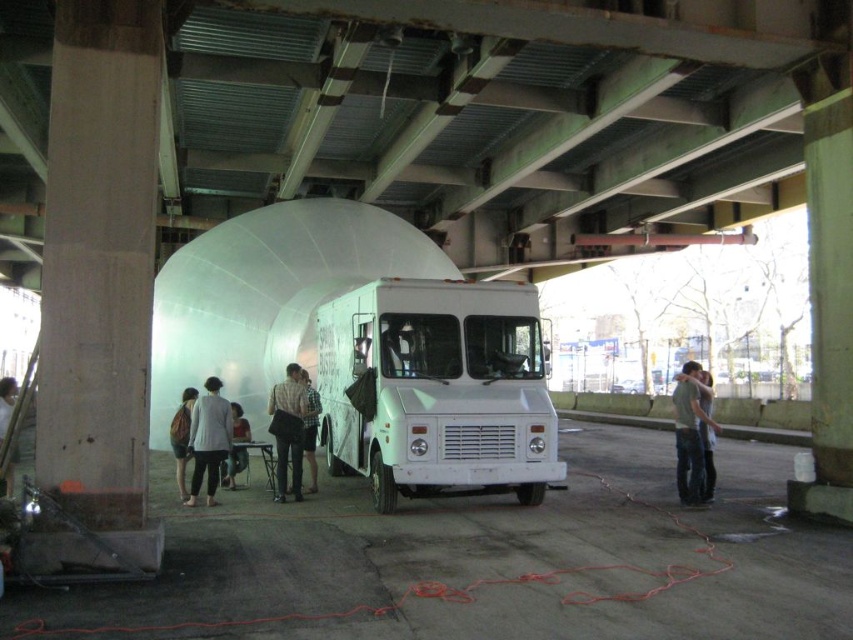
Question: Is white matte food truck at center positioned behind gray cotton shirt at center?

Choices:
 (A) yes
 (B) no

Answer: (B)

Question: Does white matte food truck at center have a lesser width compared to light gray fabric jacket at lower left?

Choices:
 (A) yes
 (B) no

Answer: (B)

Question: Which point appears closest to the camera in this image?

Choices:
 (A) (291, 403)
 (B) (473, 282)
 (C) (173, 451)

Answer: (B)

Question: Can you confirm if white matte food truck at center is positioned below white matte jacket at lower center?

Choices:
 (A) no
 (B) yes

Answer: (A)

Question: Which object is positioned farthest from the gray cotton shirt at center?

Choices:
 (A) denim shorts at lower left
 (B) light gray fabric jacket at lower left
 (C) white matte jacket at lower center

Answer: (A)

Question: Among these points, which one is farthest from the camera?

Choices:
 (A) (189, 426)
 (B) (303, 401)
 (C) (431, 337)

Answer: (A)